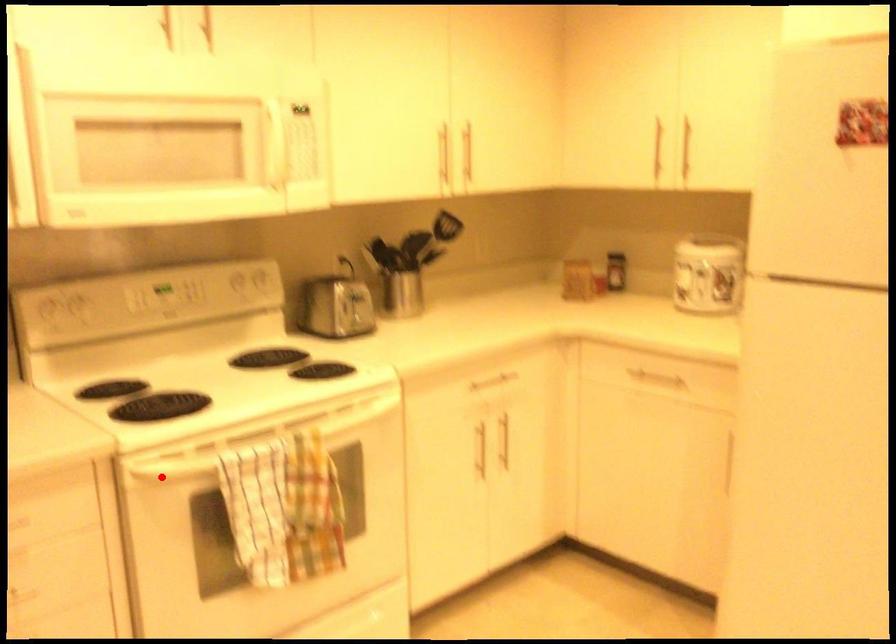
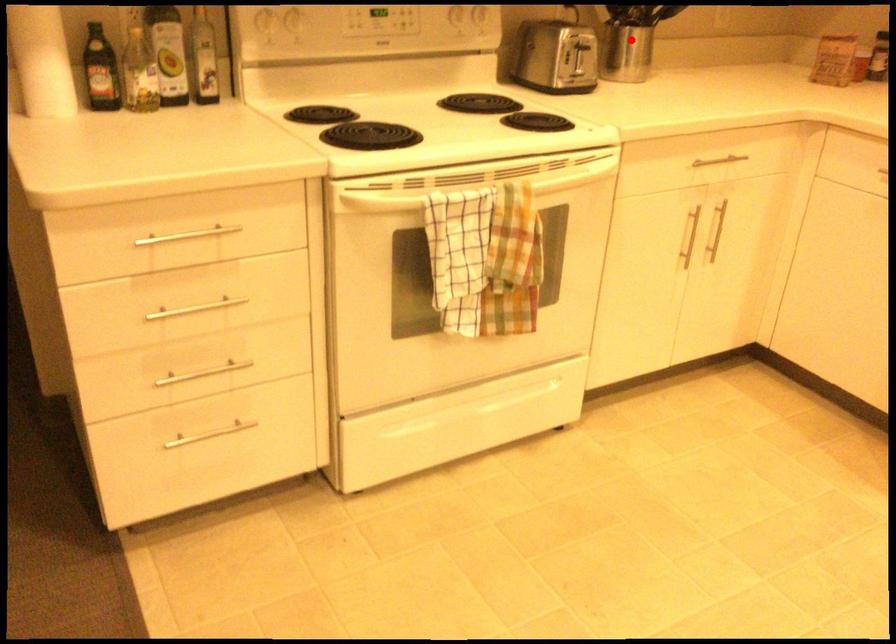
I am providing you with two images of the same scene from different viewpoints. A red point is marked on the first image and another point is marked on the second image. Are the points marked in image1 and image2 representing the same 3D position?

No